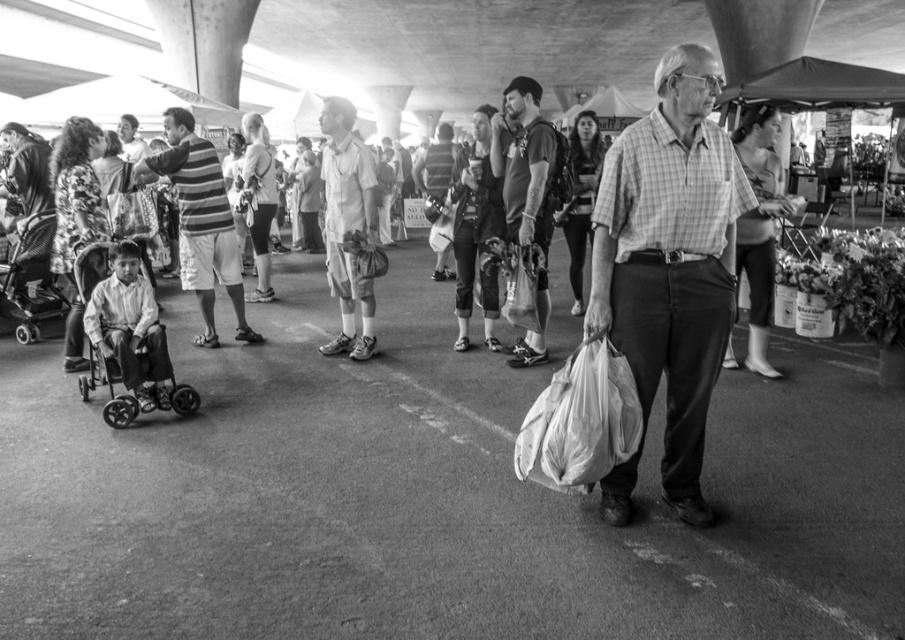
Question: Estimate the real-world distances between objects in this image. Which object is farther from the striped fabric shirt at center?

Choices:
 (A) dark gray t-shirt at center
 (B) matte white plastic bag at center

Answer: (B)

Question: Does dark gray t-shirt at center appear under light brown leather shoes at center?

Choices:
 (A) no
 (B) yes

Answer: (A)

Question: Which of the following is the closest to the observer?

Choices:
 (A) plastic baby carriage at left
 (B) dark gray t-shirt at center
 (C) striped fabric shirt at center

Answer: (B)

Question: Is light brown leather shoes at center below plastic baby carriage at left?

Choices:
 (A) yes
 (B) no

Answer: (B)

Question: Where is dark gray t-shirt at center located in relation to light brown leather shoes at center in the image?

Choices:
 (A) below
 (B) above

Answer: (B)

Question: Based on their relative distances, which object is nearer to the striped fabric shirt at center?

Choices:
 (A) matte white plastic bag at center
 (B) light brown leather shoes at center
 (C) plastic baby carriage at left
 (D) dark gray t-shirt at center

Answer: (B)